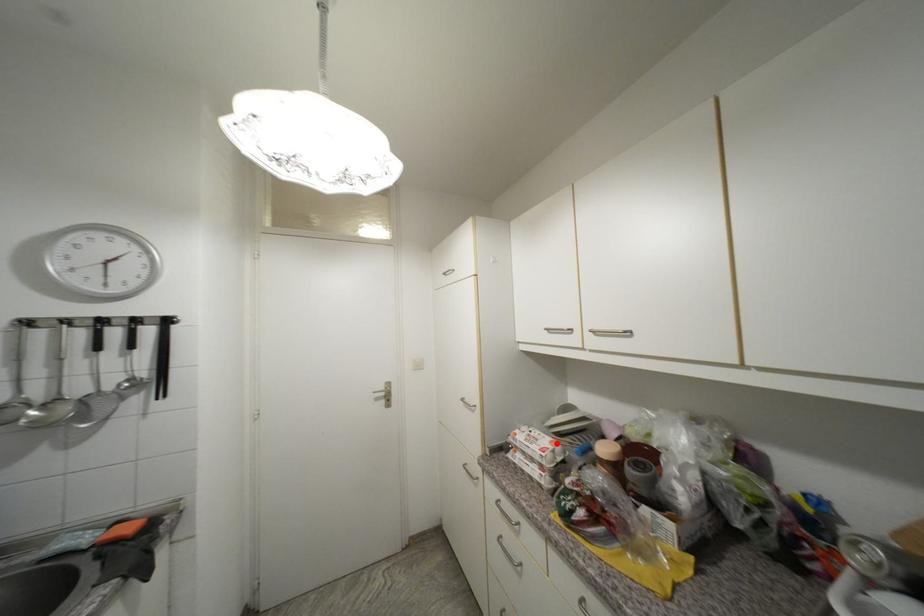
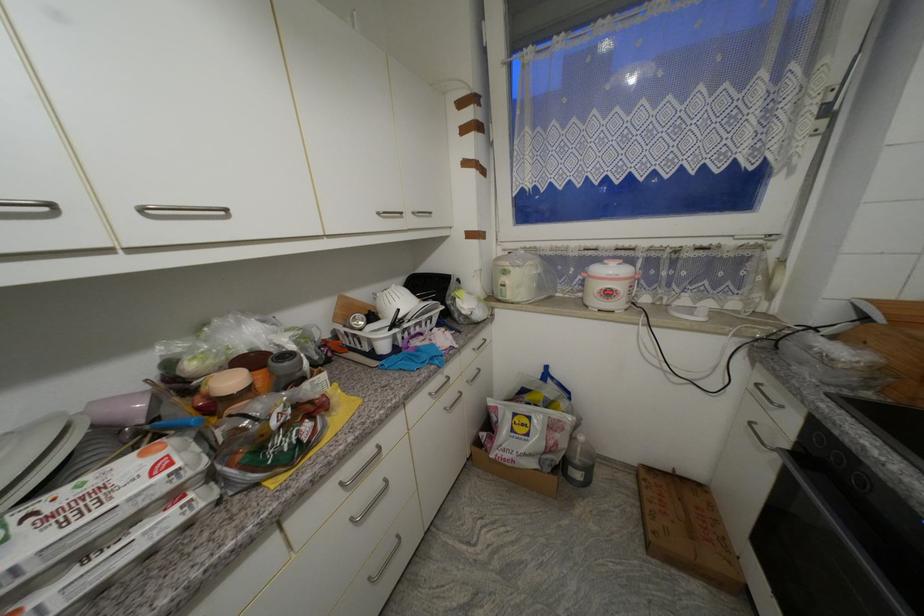
Locate, in the second image, the point that corresponds to the highlighted location in the first image.

(149, 456)